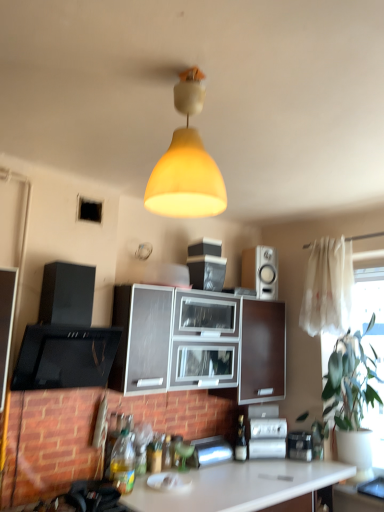
This screenshot has width=384, height=512. I want to click on vacant area that is in front of translucent glass bottle at center, placed as the third bottle when sorted from left to right, so click(x=241, y=471).